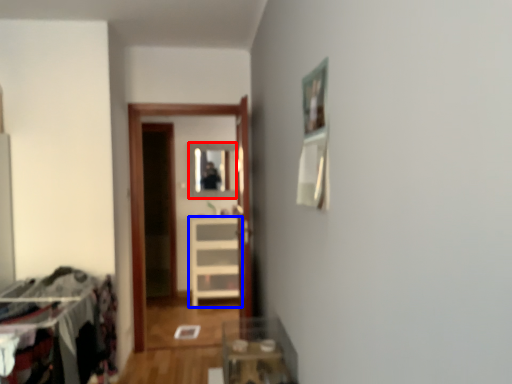
Question: Which object appears closest to the camera in this image, mirror (highlighted by a red box) or furniture (highlighted by a blue box)?

Choices:
 (A) mirror
 (B) furniture

Answer: (B)